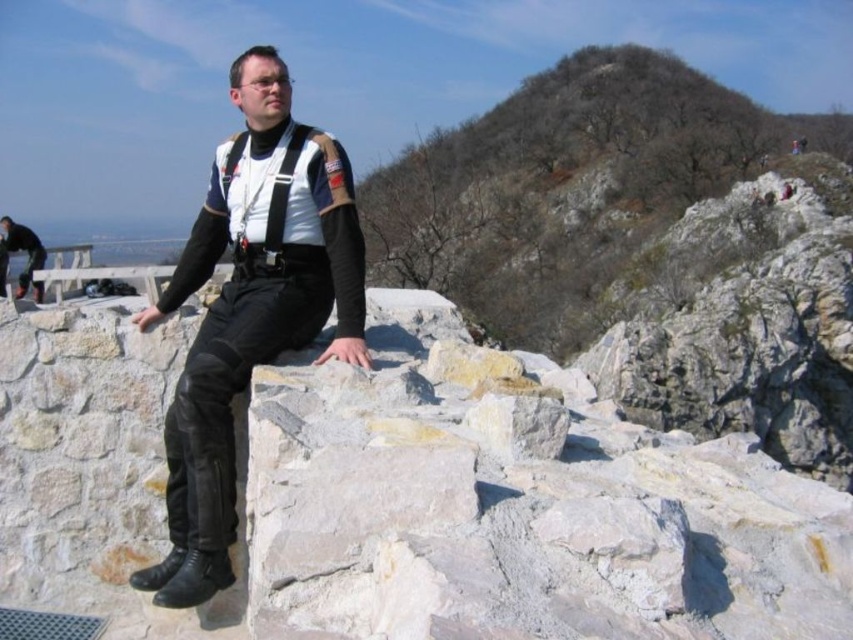
You are standing at the base of the cliff looking up at the person wearing the matte black leather pants at center. If you want to throw a small pebble to get their attention, will it be possible to reach them from your current position?

The matte black leather pants at center is 40.98 feet from viewer. Since the distance is approximately 41 feet, it may be challenging to throw a pebble that far, but it is technically possible depending on the thrower strength and technique.

You are an outdoor photographer preparing to take a photo of the rocky outcrop. You need to ensure that the matte black leather pants at center and the black leather pants at lower left are both visible in the frame. Since the pants at center are narrower, where should you position yourself to capture both effectively?

Since the matte black leather pants at center is narrower than the black leather pants at lower left, positioning yourself at a slight angle to the side of the rocky outcrop will allow both pairs of pants to be visible in the frame without one overlapping the other too much.